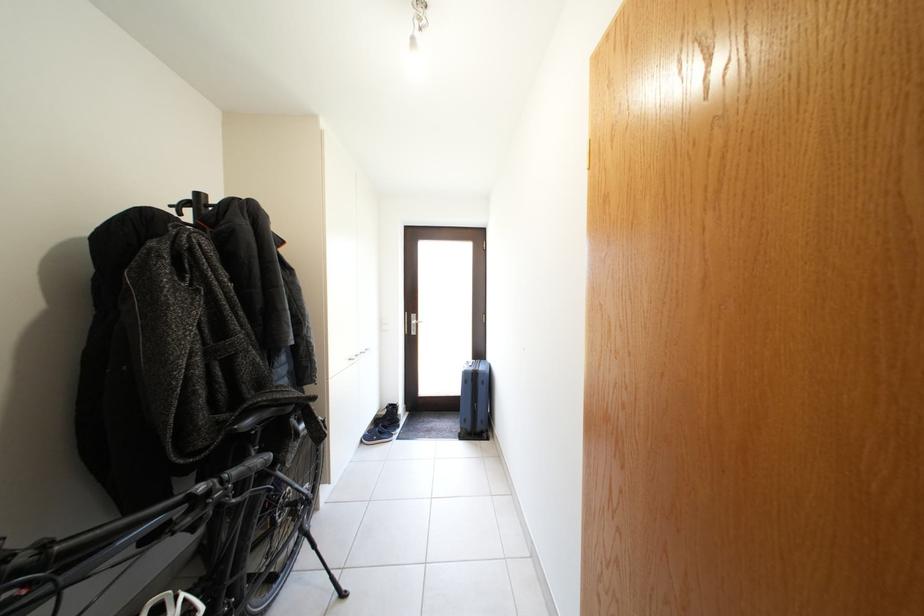
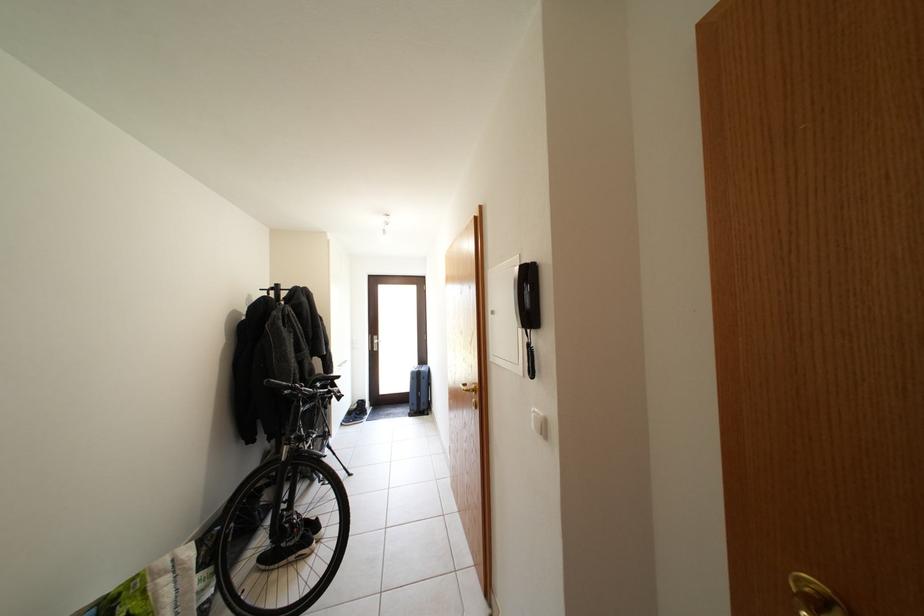
Where in the second image is the point corresponding to point (195, 208) from the first image?

(281, 294)